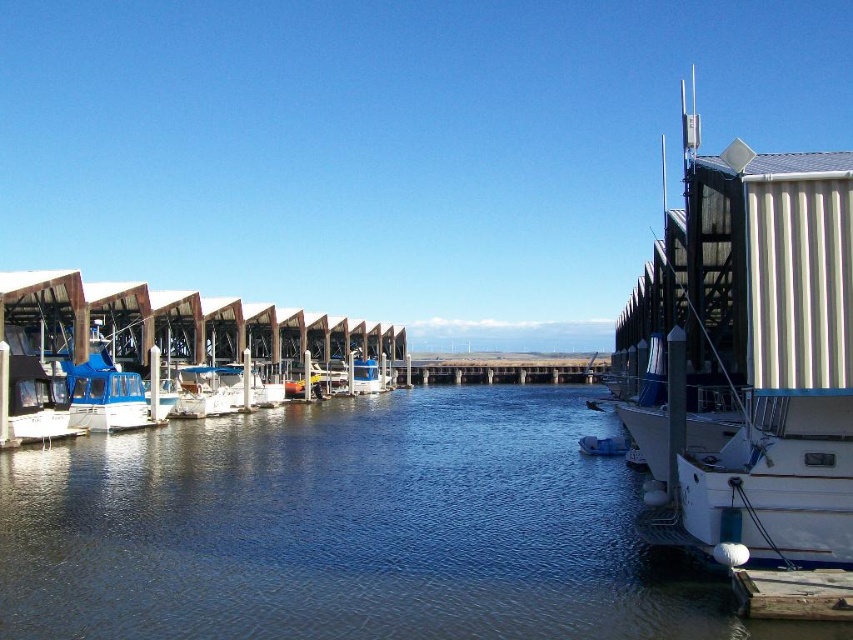
Can you confirm if wooden dock at lower right is shorter than blue matte boat at center?

Yes, wooden dock at lower right is shorter than blue matte boat at center.

Who is more forward, (822, 582) or (625, 451)?

Point (822, 582) is more forward.

Where is `wooden dock at lower right`? wooden dock at lower right is located at coordinates (793, 593).

Can you confirm if concrete at center is positioned to the right of blue matte boat at center?

No, concrete at center is not to the right of blue matte boat at center.

Is point (418, 360) positioned behind point (587, 445)?

Yes, point (418, 360) is behind point (587, 445).

Identify the location of concrete at center. (498, 371).

Does blue glossy boat at left have a smaller size compared to concrete at center?

Correct, blue glossy boat at left occupies less space than concrete at center.

Is blue glossy boat at left bigger than concrete at center?

No.

Who is more distant from viewer, (83, 369) or (473, 360)?

The point (473, 360) is more distant.

Find the location of `blue glossy boat at left`. blue glossy boat at left is located at coordinates (106, 394).